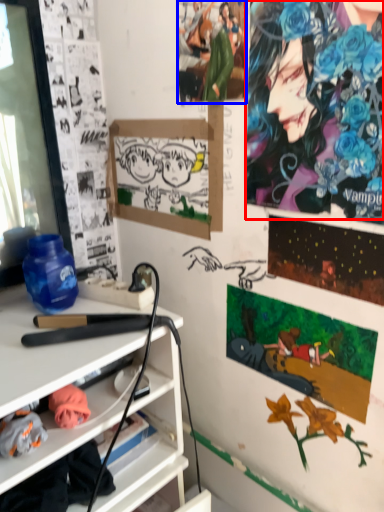
Question: Which object is further to the camera taking this photo, person (highlighted by a red box) or person (highlighted by a blue box)?

Choices:
 (A) person
 (B) person

Answer: (B)